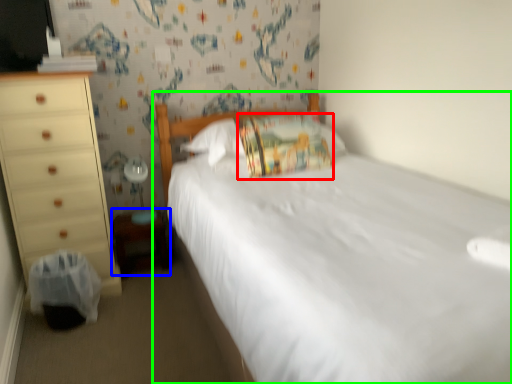
Question: Which is farther away from pillow (highlighted by a red box)? changing table (highlighted by a blue box) or bed (highlighted by a green box)?

Choices:
 (A) changing table
 (B) bed

Answer: (A)